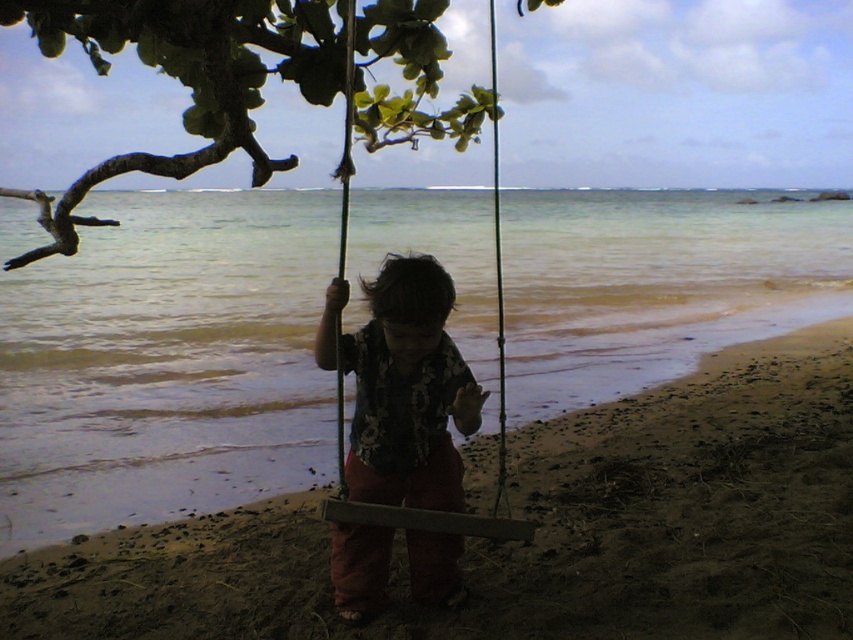
You are a photographer trying to capture the entire scene of the brown sandy beach at center and the green leafy branch at upper left in one shot. Based on their sizes, which object should you focus on to ensure both are visible in the frame?

The brown sandy beach at center has a smaller size compared to green leafy branch at upper left. To ensure both are visible, focus on the larger object, the green leafy branch at upper left, while positioning the camera to include the smaller brown sandy beach at center within the frame.

You are standing at the edge of the brown sandy beach at center. If you look directly ahead, what would you see?

The brown sandy beach at center is located at point (537, 531), so looking directly ahead from the edge would show the sandy beach extending forward from that central point.

You are a park ranger checking the safety of the swing set. The swing is attached to the green leafy branch at upper left. Based on the coordinates provided, is the branch positioned at the top left corner of the frame?

Yes, the green leafy branch at upper left is located at point (248, 77), which corresponds to the top left corner of the frame.